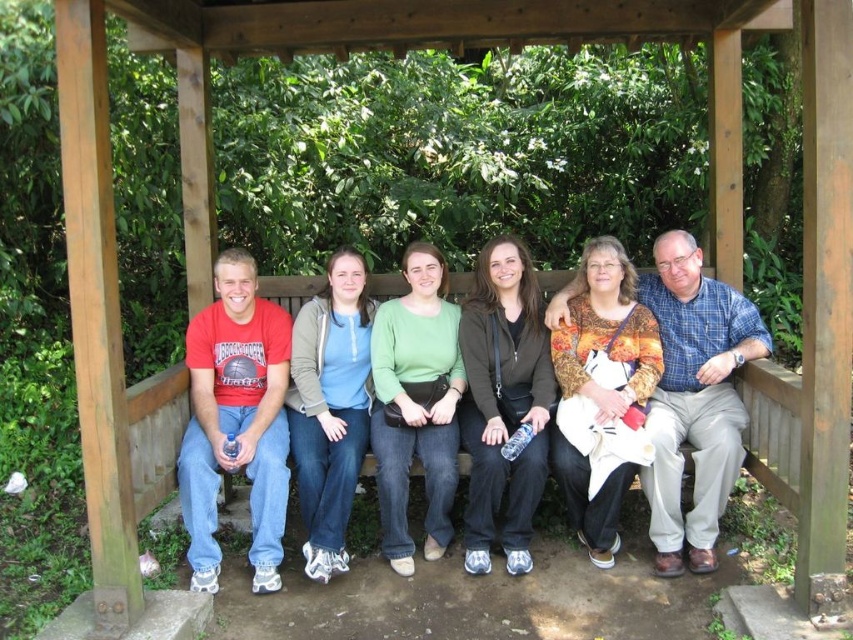
You are a photographer planning to take a group photo of the people on the wooden bench under the gazebo. You want to ensure that both the printed fabric blouse at center and the light blue cotton shirt at center are clearly visible in the photo. Which of these two items should you focus on to ensure it takes up more space in the frame?

The printed fabric blouse at center should be focused on because it is larger in size than the light blue cotton shirt at center, so it will naturally take up more space in the frame.

From the picture: You are a photographer taking a group photo of the people sitting on the wooden bench under the gazebo. You want to ensure that both the printed fabric blouse at center and the light blue cotton shirt at center are clearly visible in the photo. Which clothing item should you focus on to ensure it stands out more due to its size?

The printed fabric blouse at center has a greater height compared to the light blue cotton shirt at center, so focusing on the printed fabric blouse at center would make it stand out more in the photo due to its larger size.